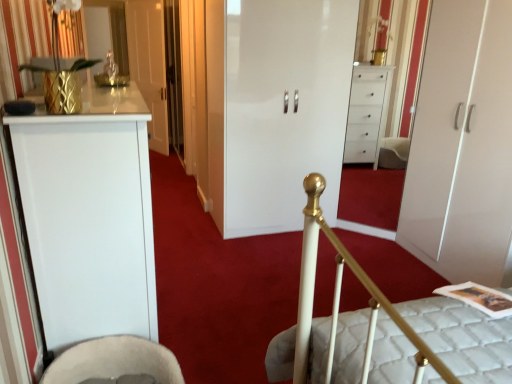
Measure the distance between white glossy cabinet at center, placed as the 2th door when sorted from front to back, and camera.

white glossy cabinet at center, placed as the 2th door when sorted from front to back, is 2.86 meters away from camera.

Where is `beige fabric rocking chair at lower left`? The image size is (512, 384). beige fabric rocking chair at lower left is located at coordinates [115, 363].

Describe the element at coordinates (115, 363) in the screenshot. The image size is (512, 384). I see `beige fabric rocking chair at lower left` at that location.

I want to click on white quilted mattress at center, so click(383, 329).

Locate an element on the screen. white glossy wardrobe at center, acting as the 1th door starting from the front is located at coordinates (463, 146).

Identify the location of door behind the white glossy cabinet at center, positioned as the second door in back-to-front order. (149, 64).

From a real-world perspective, does white glossy cabinet at center, positioned as the second door in back-to-front order, sit lower than white glossy door at upper left, which is the 3th door from front to back?

Yes.

In the scene shown: Is white glossy cabinet at center, placed as the 2th door when sorted from front to back, not near white glossy door at upper left, which is the 3th door from right to left?

white glossy cabinet at center, placed as the 2th door when sorted from front to back, is far away from white glossy door at upper left, which is the 3th door from right to left.

From a real-world perspective, is white glossy wardrobe at center, acting as the 1th door starting from the front, located beneath white quilted mattress at center?

No, from a real-world perspective, white glossy wardrobe at center, acting as the 1th door starting from the front, is not under white quilted mattress at center.

Considering the relative sizes of white glossy wardrobe at center, acting as the 1th door starting from the front, and white quilted mattress at center in the image provided, is white glossy wardrobe at center, acting as the 1th door starting from the front, thinner than white quilted mattress at center?

Yes, white glossy wardrobe at center, acting as the 1th door starting from the front, is thinner than white quilted mattress at center.

Is gold textured pineapple at upper left smaller than white glossy wardrobe at center, which appears as the third door when viewed from the left?

Result: Indeed, gold textured pineapple at upper left has a smaller size compared to white glossy wardrobe at center, which appears as the third door when viewed from the left.

In the scene shown: Does gold textured pineapple at upper left lie behind white glossy wardrobe at center, which appears as the third door when viewed from the left?

No, it is not.

Which is closer, (x=30, y=54) or (x=510, y=32)?

The point (x=30, y=54) is closer to the camera.

In order to click on curtain lying in front of the white glossy wardrobe at center, acting as the 3th door starting from the back in this screenshot , I will do `click(24, 39)`.

From a real-world perspective, is beige fabric rocking chair at lower left physically located above or below white quilted mattress at center?

From a real-world perspective, beige fabric rocking chair at lower left is physically below white quilted mattress at center.

Which object is closer to the camera taking this photo, beige fabric rocking chair at lower left or white quilted mattress at center?

Positioned in front is white quilted mattress at center.

Is beige fabric rocking chair at lower left situated inside white quilted mattress at center or outside?

The correct answer is: outside.

Does white glossy door at upper left, the first door viewed from the back, lie in front of white glossy wardrobe at center, which appears as the third door when viewed from the left?

No, white glossy door at upper left, the first door viewed from the back, is behind white glossy wardrobe at center, which appears as the third door when viewed from the left.

Is white glossy door at upper left, which is the 3th door from right to left, positioned with its back to white glossy wardrobe at center, acting as the 1th door starting from the front?

No.

Is white glossy door at upper left, the first door viewed from the back, wider or thinner than white glossy wardrobe at center, which appears as the third door when viewed from the left?

In the image, white glossy door at upper left, the first door viewed from the back, appears to be more narrow than white glossy wardrobe at center, which appears as the third door when viewed from the left.

Is white glossy wardrobe at center, acting as the 1th door starting from the front, surrounding white glossy door at upper left, which is the 3th door from right to left?

No.

Is white glossy wardrobe at center, acting as the 1th door starting from the front, looking in the opposite direction of white glossy door at upper left, which is the 3th door from right to left?

white glossy wardrobe at center, acting as the 1th door starting from the front, does not have its back to white glossy door at upper left, which is the 3th door from right to left.

Is white glossy wardrobe at center, acting as the first door starting from the right, bigger than white glossy door at upper left, which is the 3th door from right to left?

Indeed, white glossy wardrobe at center, acting as the first door starting from the right, has a larger size compared to white glossy door at upper left, which is the 3th door from right to left.

How different are the orientations of white glossy wardrobe at center, acting as the 1th door starting from the front, and white glossy door at upper left, which is the 3th door from front to back, in degrees?

The angle between the facing direction of white glossy wardrobe at center, acting as the 1th door starting from the front, and the facing direction of white glossy door at upper left, which is the 3th door from front to back, is 33.9 degrees.

Which object is more forward, white quilted mattress at center or white glossy wardrobe at center, acting as the 3th door starting from the back?

Positioned in front is white quilted mattress at center.

How different are the orientations of white quilted mattress at center and white glossy wardrobe at center, which appears as the third door when viewed from the left, in degrees?

white quilted mattress at center and white glossy wardrobe at center, which appears as the third door when viewed from the left, are facing 0.892 degrees away from each other.

From the image's perspective, who appears lower, white quilted mattress at center or white glossy wardrobe at center, acting as the 3th door starting from the back?

white quilted mattress at center.

From a real-world perspective, does white quilted mattress at center sit lower than white glossy wardrobe at center, which appears as the third door when viewed from the left?

Yes, from a real-world perspective, white quilted mattress at center is below white glossy wardrobe at center, which appears as the third door when viewed from the left.

I want to click on the 1st door to the right of the white glossy door at upper left, the first door viewed from the back, starting your count from the anchor, so click(276, 108).

Where is `bed on the left of white glossy wardrobe at center, acting as the first door starting from the right`? bed on the left of white glossy wardrobe at center, acting as the first door starting from the right is located at coordinates (383, 329).

Looking at the image, which one is located further to beige fabric rocking chair at lower left, white quilted mattress at center or white glossy wardrobe at center, acting as the 3th door starting from the back?

white glossy wardrobe at center, acting as the 3th door starting from the back, is further to beige fabric rocking chair at lower left.

Which object lies further to the anchor point white glossy wardrobe at center, acting as the first door starting from the right, white glossy cabinet at center, positioned as the second door in back-to-front order, or white glossy door at upper left, the first door viewed from the left?

The object further to white glossy wardrobe at center, acting as the first door starting from the right, is white glossy door at upper left, the first door viewed from the left.

When comparing their distances from beige fabric rocking chair at lower left, does white quilted mattress at center or white glossy door at upper left, the first door viewed from the left, seem further?

white glossy door at upper left, the first door viewed from the left, is positioned further to the anchor beige fabric rocking chair at lower left.

Considering their positions, is white glossy wardrobe at center, which appears as the third door when viewed from the left, positioned further to white glossy door at upper left, which is the 3th door from front to back, than beige fabric rocking chair at lower left?

Among the two, beige fabric rocking chair at lower left is located further to white glossy door at upper left, which is the 3th door from front to back.

Looking at the image, which one is located further to white quilted mattress at center, white glossy wardrobe at center, acting as the 3th door starting from the back, or beige fabric rocking chair at lower left?

white glossy wardrobe at center, acting as the 3th door starting from the back.

Estimate the real-world distances between objects in this image. Which object is closer to white quilted mattress at center, beige fabric rocking chair at lower left or white glossy wardrobe at center, acting as the 3th door starting from the back?

The object closer to white quilted mattress at center is beige fabric rocking chair at lower left.

Which object lies further to the anchor point white glossy door at upper left, which is the 3th door from front to back, white glossy cabinet at center, which is the 2th door from left to right, or white quilted mattress at center?

white quilted mattress at center lies further to white glossy door at upper left, which is the 3th door from front to back, than the other object.

Estimate the real-world distances between objects in this image. Which object is further from white glossy wardrobe at center, acting as the first door starting from the right, beige fabric rocking chair at lower left or white glossy door at upper left, the first door viewed from the left?

white glossy door at upper left, the first door viewed from the left, is further to white glossy wardrobe at center, acting as the first door starting from the right.

This screenshot has width=512, height=384. I want to click on rocking chair between white quilted mattress at center and white glossy door at upper left, which is the 3th door from front to back, from front to back, so click(115, 363).

Where is `rocking chair located between gold textured pineapple at upper left and white glossy wardrobe at center, which appears as the third door when viewed from the left, in the left-right direction`? Image resolution: width=512 pixels, height=384 pixels. rocking chair located between gold textured pineapple at upper left and white glossy wardrobe at center, which appears as the third door when viewed from the left, in the left-right direction is located at coordinates (115, 363).

This screenshot has height=384, width=512. Find the location of `rocking chair located between gold textured pineapple at upper left and white glossy door at upper left, the first door viewed from the left, in the depth direction`. rocking chair located between gold textured pineapple at upper left and white glossy door at upper left, the first door viewed from the left, in the depth direction is located at coordinates (115, 363).

Where is `door between beige fabric rocking chair at lower left and white glossy wardrobe at center, acting as the first door starting from the right`? door between beige fabric rocking chair at lower left and white glossy wardrobe at center, acting as the first door starting from the right is located at coordinates (276, 108).